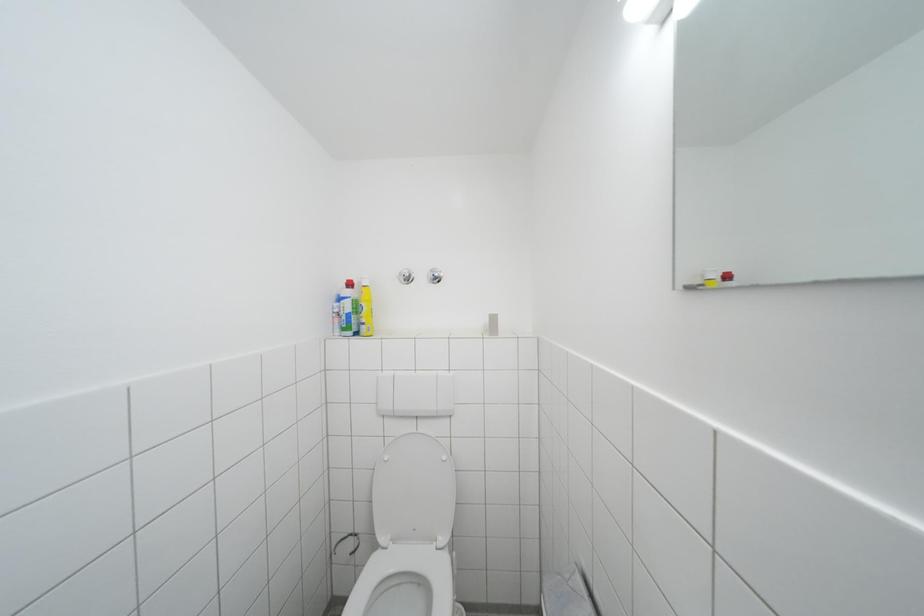
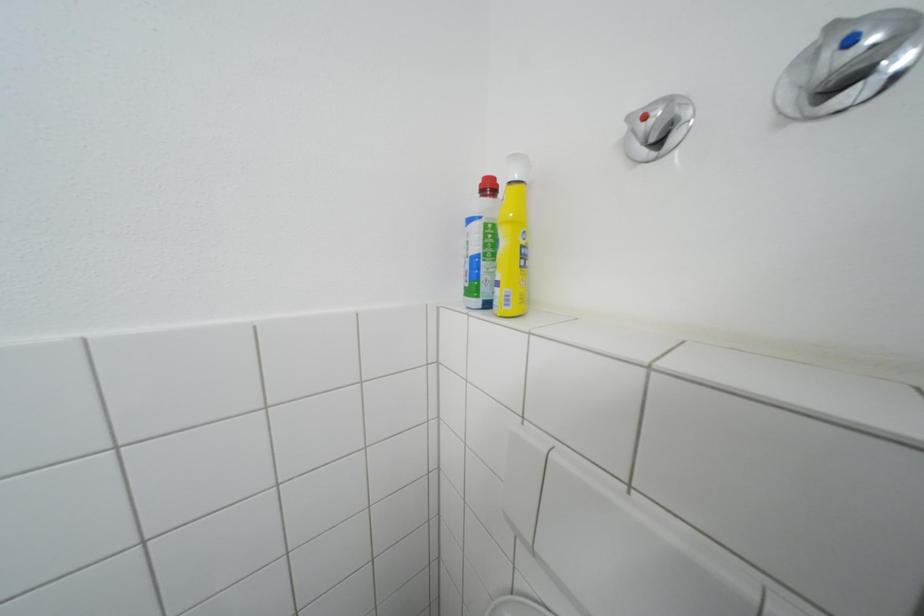
Question: The images are taken continuously from a first-person perspective. In which direction is your viewpoint rotating?

Choices:
 (A) Left
 (B) Right
 (C) Up
 (D) Down

Answer: (A)